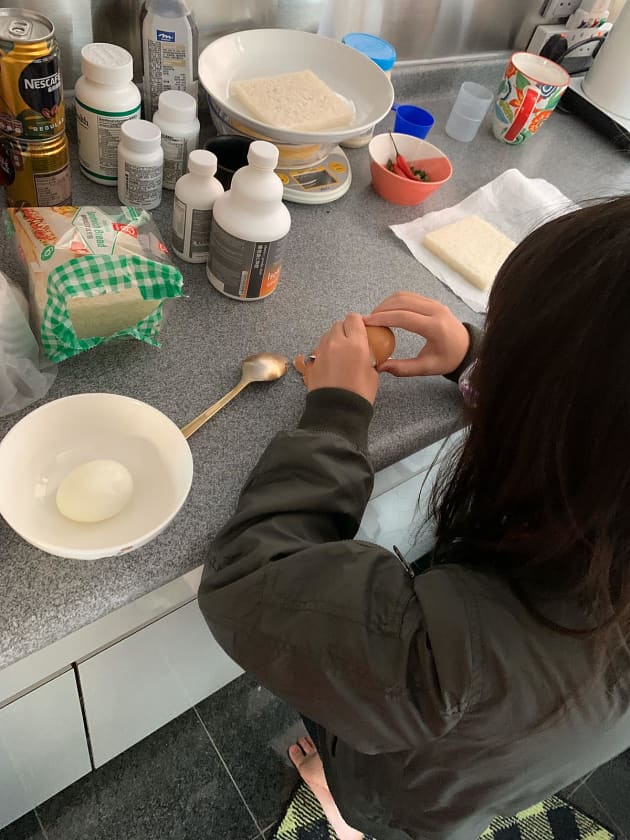
This screenshot has width=630, height=840. Find the location of `white bowl`. white bowl is located at coordinates (156, 480).